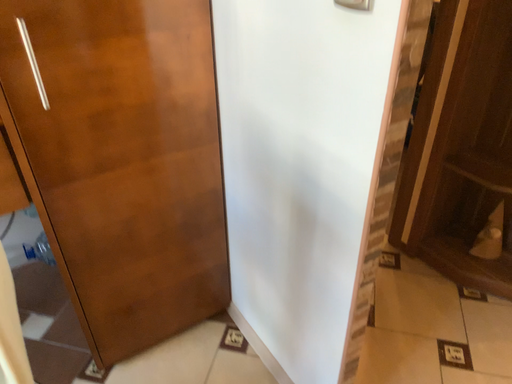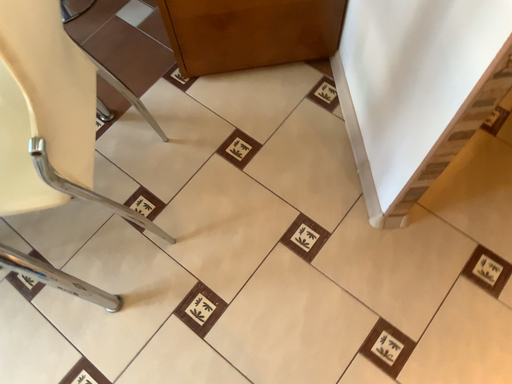
Question: How did the camera likely rotate when shooting the video?

Choices:
 (A) rotated upward
 (B) rotated downward

Answer: (B)